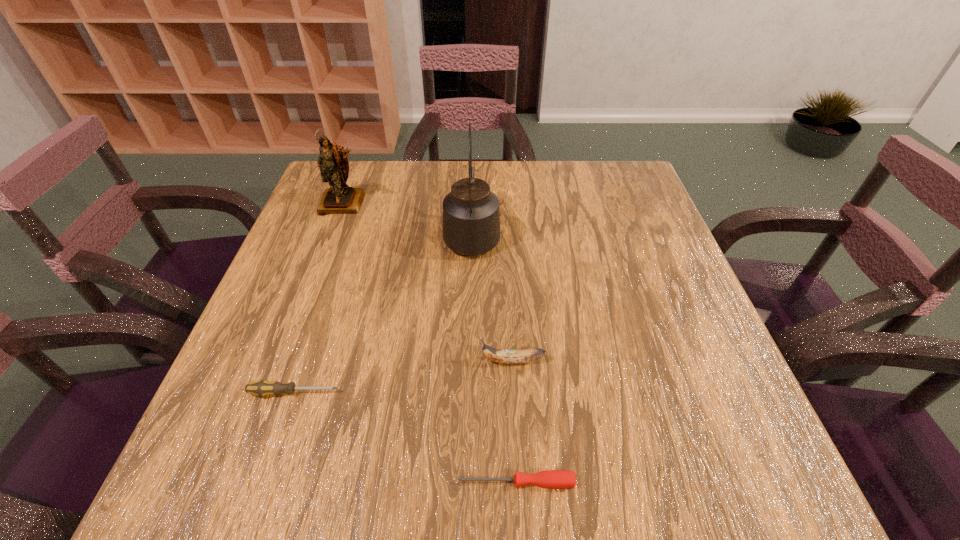
The image size is (960, 540). What are the coordinates of `object positioned at the near edge` in the screenshot? It's located at (554, 479).

Find the location of `figurine situated at the left edge`. figurine situated at the left edge is located at coordinates (334, 167).

Identify the location of screwdriver located in the left edge section of the desktop. (261, 388).

Where is `object positioned at the far left corner`? object positioned at the far left corner is located at coordinates (334, 167).

You are a GUI agent. You are given a task and a screenshot of the screen. Output one action in this format:
    pyautogui.click(x=<x>, y=<y>)
    Task: Click on the free space at the far edge of the desktop
    
    Given the screenshot: What is the action you would take?
    pyautogui.click(x=507, y=183)

Find the location of a particular element. free location at the near edge is located at coordinates (636, 464).

I want to click on free region at the left edge of the desktop, so click(x=290, y=410).

Find the location of a particular element. Image resolution: width=960 pixels, height=540 pixels. free space at the right edge of the desktop is located at coordinates (664, 390).

In the image, there is a desktop. At what (x,y) coordinates should I click in order to perform the action: click on free space at the near left corner. Please return your answer as a coordinate pair (x, y). This screenshot has width=960, height=540. Looking at the image, I should click on (294, 460).

Locate an element on the screen. The width and height of the screenshot is (960, 540). vacant space at the far right corner is located at coordinates (647, 205).